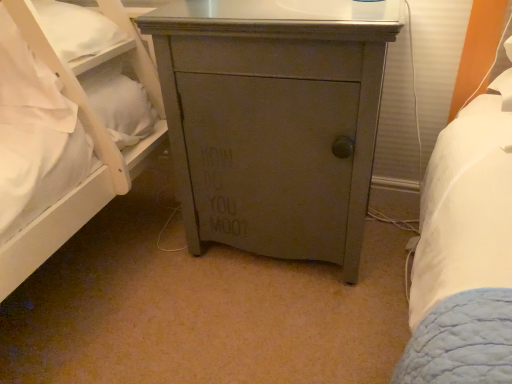
Locate an element on the screen. free space in front of matte gray cabinet at center is located at coordinates (271, 326).